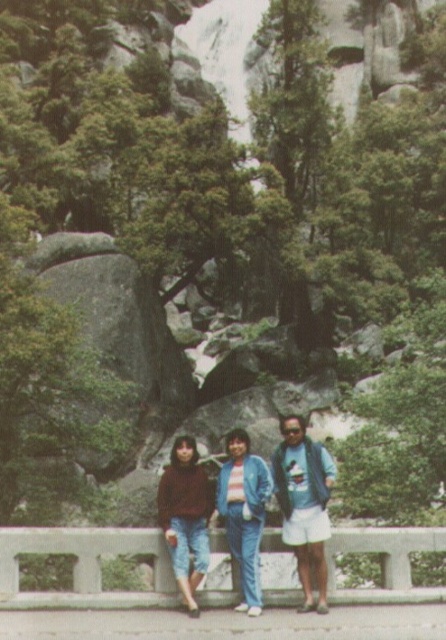
Question: Observing the image, what is the correct spatial positioning of blue denim shorts at center in reference to matte brown sweater at lower left?

Choices:
 (A) left
 (B) right

Answer: (B)

Question: Which object is the farthest from the matte blue jeans at center?

Choices:
 (A) blue denim pants at center
 (B) blue denim shorts at center

Answer: (B)

Question: Which point appears farthest from the camera in this image?

Choices:
 (A) (252, 460)
 (B) (144, 531)
 (C) (161, 486)

Answer: (C)

Question: Estimate the real-world distances between objects in this image. Which object is closer to the matte blue jeans at center?

Choices:
 (A) matte brown sweater at lower left
 (B) blue denim pants at center
 (C) concrete at center
 (D) blue denim shorts at center

Answer: (B)

Question: Does matte brown sweater at lower left appear under blue denim pants at center?

Choices:
 (A) no
 (B) yes

Answer: (A)

Question: Does concrete at center appear on the left side of blue denim shorts at center?

Choices:
 (A) yes
 (B) no

Answer: (B)